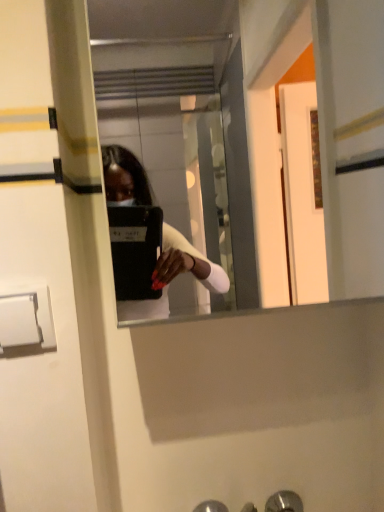
Question: Can metallic silver door handle at lower center, marked as the second door handle in a front-to-back arrangement, be found inside white plastic door handle at lower left, the 1th door handle from the front?

Choices:
 (A) no
 (B) yes

Answer: (A)

Question: Is white plastic door handle at lower left, which ranks as the 2th door handle in back-to-front order, placed right next to metallic silver door handle at lower center, positioned as the 2th door handle in left-to-right order?

Choices:
 (A) yes
 (B) no

Answer: (B)

Question: Considering the relative sizes of white plastic door handle at lower left, which ranks as the 2th door handle in right-to-left order, and metallic silver door handle at lower center, the 1th door handle in the bottom-to-top sequence, in the image provided, is white plastic door handle at lower left, which ranks as the 2th door handle in right-to-left order, shorter than metallic silver door handle at lower center, the 1th door handle in the bottom-to-top sequence,?

Choices:
 (A) yes
 (B) no

Answer: (B)

Question: Is white plastic door handle at lower left, the first door handle in the top-to-bottom sequence, smaller than metallic silver door handle at lower center, positioned as the 2th door handle in left-to-right order?

Choices:
 (A) yes
 (B) no

Answer: (A)

Question: Is white plastic door handle at lower left, the 1th door handle from the front, closer to camera compared to metallic silver door handle at lower center, the 1th door handle in the bottom-to-top sequence?

Choices:
 (A) yes
 (B) no

Answer: (A)

Question: From a real-world perspective, does white plastic door handle at lower left, the 1th door handle from the front, stand above metallic silver door handle at lower center, which is the first door handle in right-to-left order?

Choices:
 (A) yes
 (B) no

Answer: (A)

Question: Does clear glass mirror at center have a greater width compared to metallic silver door handle at lower center, the 1th door handle in the back-to-front sequence?

Choices:
 (A) yes
 (B) no

Answer: (A)

Question: Is clear glass mirror at center to the left of metallic silver door handle at lower center, which is the first door handle in right-to-left order, from the viewer's perspective?

Choices:
 (A) no
 (B) yes

Answer: (B)

Question: Is metallic silver door handle at lower center, marked as the second door handle in a front-to-back arrangement, located within clear glass mirror at center?

Choices:
 (A) yes
 (B) no

Answer: (B)

Question: From a real-world perspective, is clear glass mirror at center on top of metallic silver door handle at lower center, which is the second door handle in top-to-bottom order?

Choices:
 (A) no
 (B) yes

Answer: (B)

Question: Considering the relative sizes of clear glass mirror at center and metallic silver door handle at lower center, positioned as the 2th door handle in left-to-right order, in the image provided, is clear glass mirror at center smaller than metallic silver door handle at lower center, positioned as the 2th door handle in left-to-right order,?

Choices:
 (A) yes
 (B) no

Answer: (B)

Question: Is clear glass mirror at center closer to the viewer compared to metallic silver door handle at lower center, positioned as the 2th door handle in left-to-right order?

Choices:
 (A) no
 (B) yes

Answer: (B)

Question: Does clear glass mirror at center have a greater height compared to white plastic door handle at lower left, which ranks as the 2th door handle in right-to-left order?

Choices:
 (A) no
 (B) yes

Answer: (B)